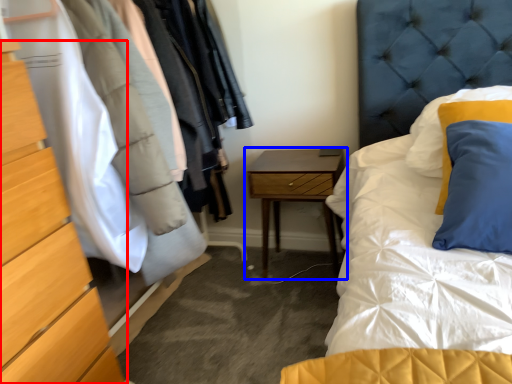
Question: Which point is further to the camera, chest of drawers (highlighted by a red box) or nightstand (highlighted by a blue box)?

Choices:
 (A) chest of drawers
 (B) nightstand

Answer: (B)